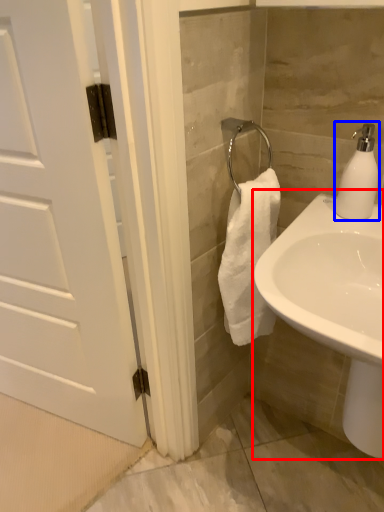
Question: Which object appears closest to the camera in this image, sink (highlighted by a red box) or soap dispenser (highlighted by a blue box)?

Choices:
 (A) sink
 (B) soap dispenser

Answer: (A)